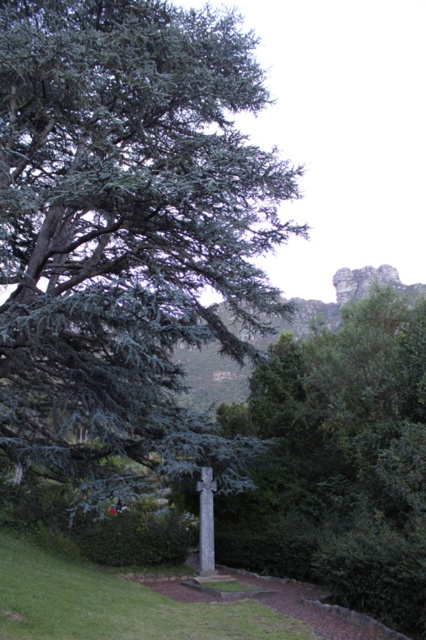
Question: Is green needle-like at center below green leafy tree at center?

Choices:
 (A) no
 (B) yes

Answer: (A)

Question: Which object appears closest to the camera in this image?

Choices:
 (A) green needle-like at center
 (B) green leafy tree at center

Answer: (B)

Question: Is the position of green needle-like at center less distant than that of green leafy tree at center?

Choices:
 (A) no
 (B) yes

Answer: (A)

Question: Considering the relative positions of green needle-like at center and green leafy tree at center in the image provided, where is green needle-like at center located with respect to green leafy tree at center?

Choices:
 (A) below
 (B) above

Answer: (B)